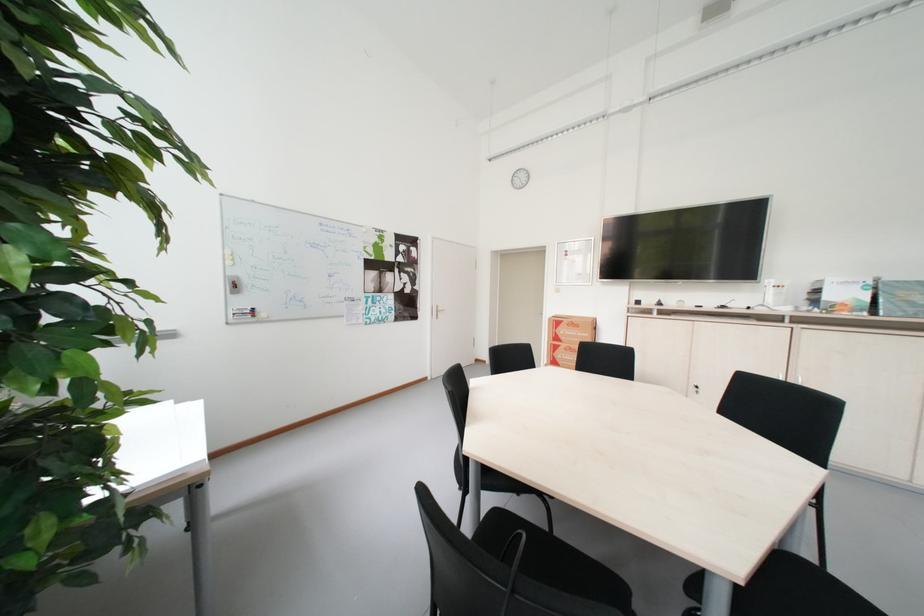
Find the location of a particular element. red whiteboard marker is located at coordinates (244, 315).